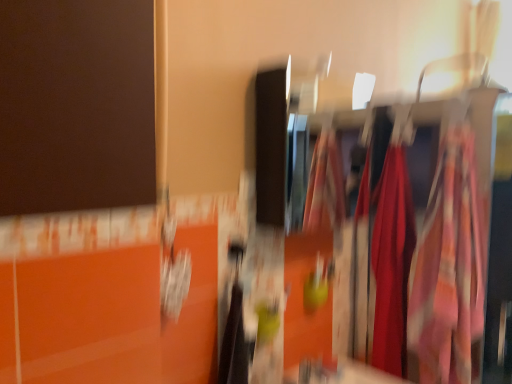
Question: In the image, is floral fabric dress at right, the 2th clothing in the back-to-front sequence, on the left side or the right side of silky red fabric at center, positioned as the second clothing in front-to-back order?

Choices:
 (A) left
 (B) right

Answer: (B)

Question: Considering the positions of floral fabric dress at right, the 2th clothing in the back-to-front sequence, and silky red fabric at center, positioned as the second clothing in front-to-back order, in the image, is floral fabric dress at right, the 2th clothing in the back-to-front sequence, taller or shorter than silky red fabric at center, positioned as the second clothing in front-to-back order,?

Choices:
 (A) tall
 (B) short

Answer: (B)

Question: Estimate the real-world distances between objects in this image. Which object is farther from the silky fabric dress at right?

Choices:
 (A) floral fabric dress at right, the 1th clothing when ordered from front to back
 (B) silky red fabric at center, marked as the 1th clothing in a back-to-front arrangement

Answer: (B)

Question: Based on their relative distances, which object is farther from the silky red fabric at center, positioned as the second clothing in front-to-back order?

Choices:
 (A) floral fabric dress at right, the 2th clothing in the back-to-front sequence
 (B) silky fabric dress at right

Answer: (A)